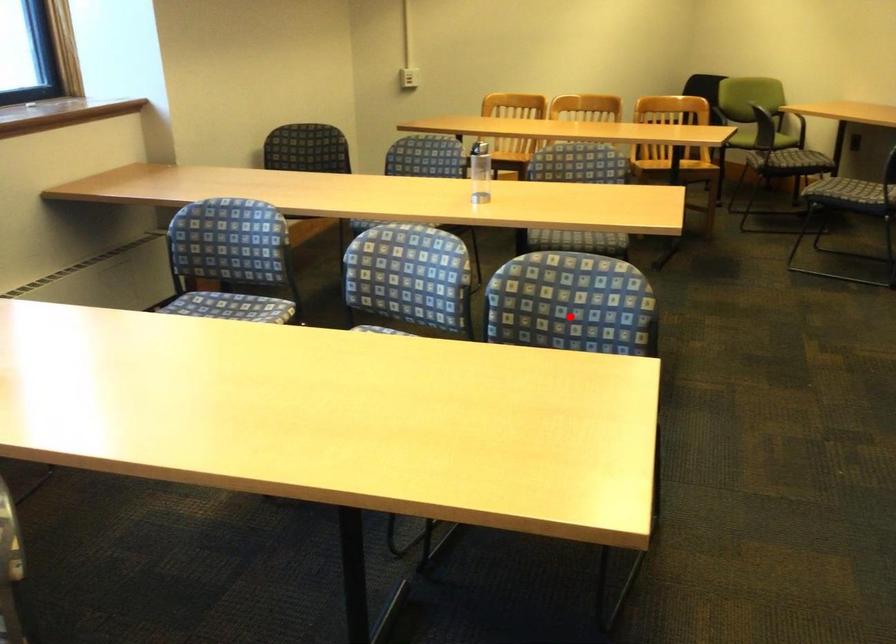
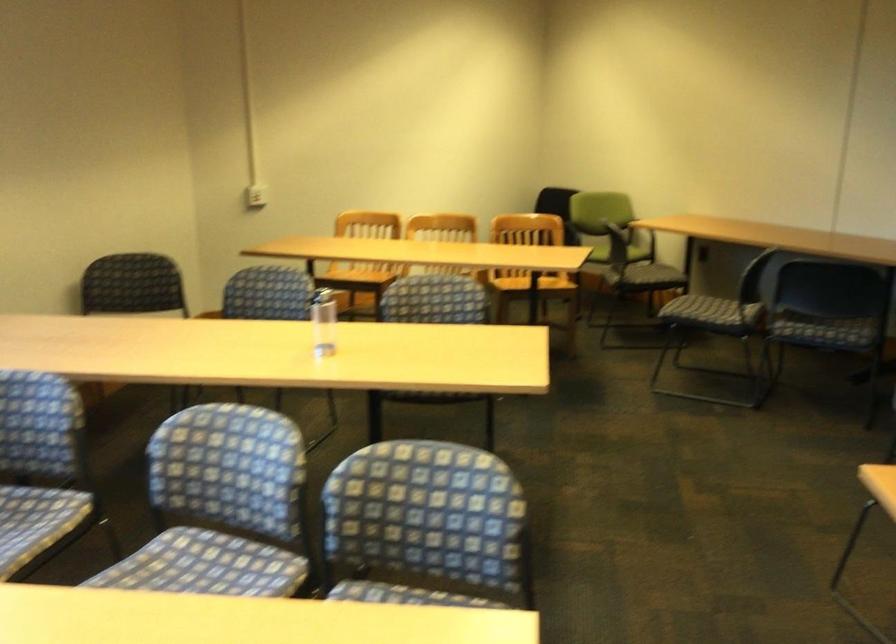
Question: I am providing you with two images of the same scene from different viewpoints. A red point is shown in image1. For the corresponding object point in image2, is it positioned nearer or farther from the camera?

Choices:
 (A) Nearer
 (B) Farther

Answer: (A)